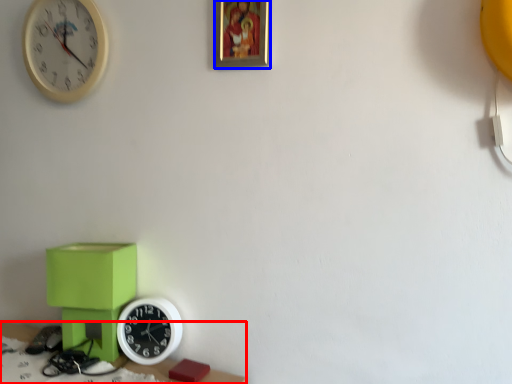
Question: Which object appears farthest to the camera in this image, table (highlighted by a red box) or picture frame (highlighted by a blue box)?

Choices:
 (A) table
 (B) picture frame

Answer: (B)